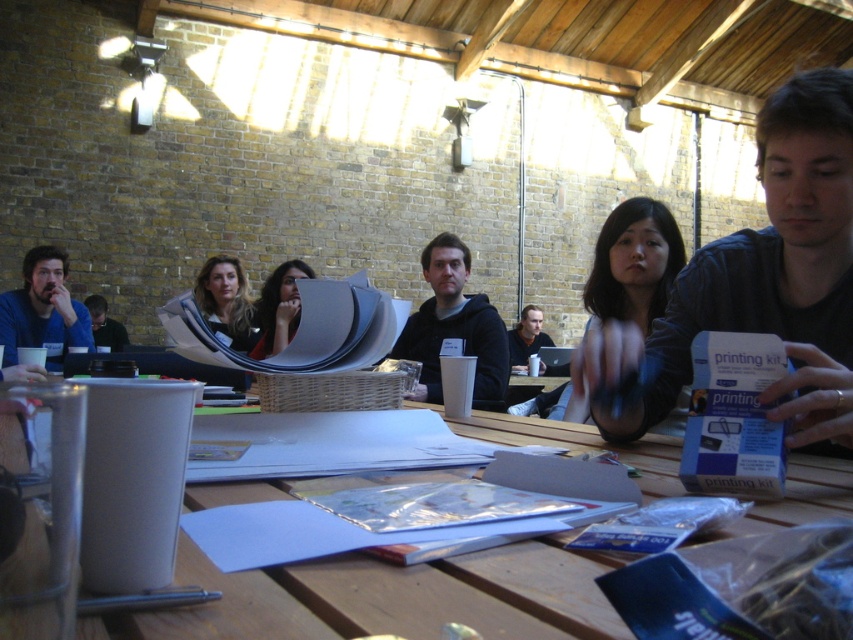
You are standing at the center of the room and want to move towards the point labeled as point (219,280). Is this point located in front of or behind the point labeled as point (537,320) from your current position?

The point labeled as point (219,280) is in front of the point labeled as point (537,320) from your current position at the center of the room.

You are a photographer wanting to capture a clear shot of both the matte black hair at center and the matte black laptop at center. Since they are both matte black, how can you ensure the camera distinguishes between them?

The matte black hair at center is located above the matte black laptop at center, so positioning the camera to capture the vertical arrangement will help distinguish them based on their spatial relationship.

You are standing at the entrance of the room and want to find the wooden picnic table at center. Based on the coordinates provided, can you determine its position relative to the room?

The wooden picnic table at center is located at coordinates 0.934 on the x axis and 0.456 on the y axis, which places it near the right side of the room since the x value is close to 1.0.